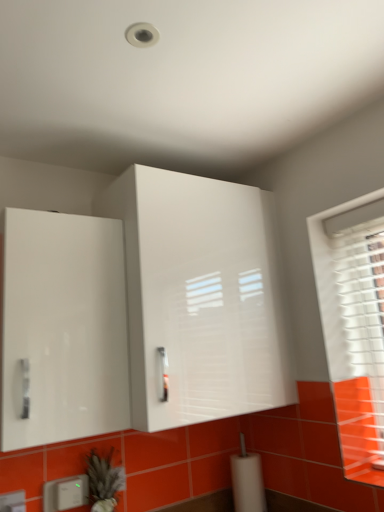
Find the location of a particular element. The image size is (384, 512). white glossy cabinet at left, the first cabinetry in the left-to-right sequence is located at coordinates (63, 328).

In order to click on white glossy cabinet at upper center, the 2th cabinetry in the left-to-right sequence in this screenshot , I will do `click(200, 298)`.

Locate an element on the screen. white glossy cabinet at left, the second cabinetry positioned from the right is located at coordinates (63, 328).

Are green fuzzy plant at lower left and white plastic electric outlet at lower left, acting as the second electric outlet starting from the front, far apart?

No, there isn't a large distance between green fuzzy plant at lower left and white plastic electric outlet at lower left, acting as the second electric outlet starting from the front.

Based on the photo, from a real-world perspective, is green fuzzy plant at lower left physically above white plastic electric outlet at lower left, positioned as the first electric outlet in right-to-left order?

No, from a real-world perspective, green fuzzy plant at lower left is not above white plastic electric outlet at lower left, positioned as the first electric outlet in right-to-left order.

Which is farther from the camera, (95,480) or (67,484)?

The point (95,480) is farther.

The image size is (384, 512). Find the location of `electric outlet lying behind the green fuzzy plant at lower left`. electric outlet lying behind the green fuzzy plant at lower left is located at coordinates (65, 493).

How different are the orientations of white glossy cabinet at upper center, the 2th cabinetry in the left-to-right sequence, and white plastic electric outlet at lower left, which appears as the first electric outlet when viewed from the left, in degrees?

There is a 0.00592-degree angle between the facing directions of white glossy cabinet at upper center, the 2th cabinetry in the left-to-right sequence, and white plastic electric outlet at lower left, which appears as the first electric outlet when viewed from the left.

Is white glossy cabinet at upper center, placed as the first cabinetry when sorted from right to left, spatially inside white plastic electric outlet at lower left, arranged as the 2th electric outlet when viewed from the back, or outside of it?

white glossy cabinet at upper center, placed as the first cabinetry when sorted from right to left, lies outside white plastic electric outlet at lower left, arranged as the 2th electric outlet when viewed from the back.

From a real-world perspective, which is physically below, white glossy cabinet at upper center, the 2th cabinetry in the left-to-right sequence, or white plastic electric outlet at lower left, marked as the 2th electric outlet in a right-to-left arrangement?

white plastic electric outlet at lower left, marked as the 2th electric outlet in a right-to-left arrangement, from a real-world perspective.

Is white glossy cabinet at upper center, placed as the first cabinetry when sorted from right to left, aimed at white plastic electric outlet at lower left, arranged as the 2th electric outlet when viewed from the back?

No, white glossy cabinet at upper center, placed as the first cabinetry when sorted from right to left, is not facing towards white plastic electric outlet at lower left, arranged as the 2th electric outlet when viewed from the back.

Between white plastic electric outlet at lower left, positioned as the first electric outlet in right-to-left order, and white glossy cabinet at left, the first cabinetry in the left-to-right sequence, which one has larger width?

white glossy cabinet at left, the first cabinetry in the left-to-right sequence.

Can we say white plastic electric outlet at lower left, acting as the second electric outlet starting from the front, lies outside white glossy cabinet at left, the first cabinetry in the left-to-right sequence?

white plastic electric outlet at lower left, acting as the second electric outlet starting from the front, lies outside white glossy cabinet at left, the first cabinetry in the left-to-right sequence,'s area.

The width and height of the screenshot is (384, 512). Find the location of `cabinetry that is the 1st object located above the white plastic electric outlet at lower left, acting as the second electric outlet starting from the front (from the image's perspective)`. cabinetry that is the 1st object located above the white plastic electric outlet at lower left, acting as the second electric outlet starting from the front (from the image's perspective) is located at coordinates (63, 328).

How much distance is there between white plastic electric outlet at lower left, acting as the second electric outlet starting from the front, and white glossy cabinet at upper center, the 2th cabinetry in the left-to-right sequence?

The distance of white plastic electric outlet at lower left, acting as the second electric outlet starting from the front, from white glossy cabinet at upper center, the 2th cabinetry in the left-to-right sequence, is 31.27 inches.

Is white plastic electric outlet at lower left, arranged as the second electric outlet when viewed from the left, aimed at white glossy cabinet at upper center, the 2th cabinetry in the left-to-right sequence?

No, white plastic electric outlet at lower left, arranged as the second electric outlet when viewed from the left, does not turn towards white glossy cabinet at upper center, the 2th cabinetry in the left-to-right sequence.

Between point (64, 483) and point (166, 344), which one is positioned behind?

Point (64, 483)

Is white glossy cabinet at upper center, placed as the first cabinetry when sorted from right to left, smaller than white plastic electric outlet at lower left, positioned as the first electric outlet in right-to-left order?

Actually, white glossy cabinet at upper center, placed as the first cabinetry when sorted from right to left, might be larger than white plastic electric outlet at lower left, positioned as the first electric outlet in right-to-left order.

From a real-world perspective, is white glossy cabinet at upper center, the 2th cabinetry in the left-to-right sequence, positioned under white plastic electric outlet at lower left, positioned as the first electric outlet in right-to-left order, based on gravity?

No, from a real-world perspective, white glossy cabinet at upper center, the 2th cabinetry in the left-to-right sequence, is not under white plastic electric outlet at lower left, positioned as the first electric outlet in right-to-left order.

Can you tell me how much white glossy cabinet at upper center, the 2th cabinetry in the left-to-right sequence, and white plastic electric outlet at lower left, which ranks as the 1th electric outlet in back-to-front order, differ in facing direction?

They differ by 0.00221 degrees in their facing directions.

Relative to white plastic electric outlet at lower left, acting as the second electric outlet starting from the front, is white glossy cabinet at upper center, placed as the first cabinetry when sorted from right to left, in front or behind?

white glossy cabinet at upper center, placed as the first cabinetry when sorted from right to left, is positioned closer to the viewer than white plastic electric outlet at lower left, acting as the second electric outlet starting from the front.

In terms of size, does white glossy cabinet at left, the second cabinetry positioned from the right, appear bigger or smaller than green fuzzy plant at lower left?

In the image, white glossy cabinet at left, the second cabinetry positioned from the right, appears to be larger than green fuzzy plant at lower left.

Is white glossy cabinet at left, the first cabinetry in the left-to-right sequence, situated inside green fuzzy plant at lower left or outside?

white glossy cabinet at left, the first cabinetry in the left-to-right sequence, cannot be found inside green fuzzy plant at lower left.

Looking at this image, is white glossy cabinet at left, the first cabinetry in the left-to-right sequence, turned away from green fuzzy plant at lower left?

That's not correct — white glossy cabinet at left, the first cabinetry in the left-to-right sequence, is not looking away from green fuzzy plant at lower left.

Is point (59, 379) more distant than point (157, 409)?

No, it is not.

Considering the relative positions of white glossy cabinet at left, the second cabinetry positioned from the right, and white glossy cabinet at upper center, placed as the first cabinetry when sorted from right to left, in the image provided, is white glossy cabinet at left, the second cabinetry positioned from the right, to the left of white glossy cabinet at upper center, placed as the first cabinetry when sorted from right to left, from the viewer's perspective?

Yes, white glossy cabinet at left, the second cabinetry positioned from the right, is to the left of white glossy cabinet at upper center, placed as the first cabinetry when sorted from right to left.

Would you say white glossy cabinet at left, the second cabinetry positioned from the right, is outside white glossy cabinet at upper center, the 2th cabinetry in the left-to-right sequence?

That's correct, white glossy cabinet at left, the second cabinetry positioned from the right, is outside of white glossy cabinet at upper center, the 2th cabinetry in the left-to-right sequence.

Is white glossy cabinet at left, the first cabinetry in the left-to-right sequence, positioned in front of white glossy cabinet at upper center, placed as the first cabinetry when sorted from right to left?

Yes, white glossy cabinet at left, the first cabinetry in the left-to-right sequence, is closer to the viewer.

You are a GUI agent. You are given a task and a screenshot of the screen. Output one action in this format:
    pyautogui.click(x=<x>, y=<y>)
    Task: Click on the plant that is below the white plastic electric outlet at lower left, acting as the second electric outlet starting from the front (from the image's perspective)
    Image resolution: width=384 pixels, height=512 pixels.
    Given the screenshot: What is the action you would take?
    pyautogui.click(x=104, y=481)

I want to click on the 2nd electric outlet to the left of the white glossy cabinet at upper center, placed as the first cabinetry when sorted from right to left, counting from the anchor's position, so click(x=13, y=502).

From the image, which object appears to be farther from white plastic electric outlet at lower left, which ranks as the 1th electric outlet in back-to-front order, green fuzzy plant at lower left or white glossy cabinet at left, the first cabinetry in the left-to-right sequence?

The object further to white plastic electric outlet at lower left, which ranks as the 1th electric outlet in back-to-front order, is white glossy cabinet at left, the first cabinetry in the left-to-right sequence.

Considering their positions, is white glossy cabinet at upper center, the 2th cabinetry in the left-to-right sequence, positioned further to white plastic electric outlet at lower left, which ranks as the first electric outlet in front-to-back order, than green fuzzy plant at lower left?

Based on the image, white glossy cabinet at upper center, the 2th cabinetry in the left-to-right sequence, appears to be further to white plastic electric outlet at lower left, which ranks as the first electric outlet in front-to-back order.

Estimate the real-world distances between objects in this image. Which object is closer to white glossy cabinet at left, the first cabinetry in the left-to-right sequence, white plastic electric outlet at lower left, marked as the 2th electric outlet in a right-to-left arrangement, or white plastic electric outlet at lower left, arranged as the second electric outlet when viewed from the left?

white plastic electric outlet at lower left, arranged as the second electric outlet when viewed from the left, is positioned closer to the anchor white glossy cabinet at left, the first cabinetry in the left-to-right sequence.

Based on their spatial positions, is white plastic electric outlet at lower left, arranged as the second electric outlet when viewed from the left, or green fuzzy plant at lower left closer to white glossy cabinet at upper center, placed as the first cabinetry when sorted from right to left?

Among the two, green fuzzy plant at lower left is located nearer to white glossy cabinet at upper center, placed as the first cabinetry when sorted from right to left.

Consider the image. Considering their positions, is green fuzzy plant at lower left positioned further to white plastic electric outlet at lower left, which ranks as the first electric outlet in front-to-back order, than white glossy cabinet at left, the second cabinetry positioned from the right?

white glossy cabinet at left, the second cabinetry positioned from the right, is further to white plastic electric outlet at lower left, which ranks as the first electric outlet in front-to-back order.

Which object lies nearer to the anchor point green fuzzy plant at lower left, white plastic electric outlet at lower left, arranged as the second electric outlet when viewed from the left, or white plastic electric outlet at lower left, which ranks as the first electric outlet in front-to-back order?

white plastic electric outlet at lower left, arranged as the second electric outlet when viewed from the left, is positioned closer to the anchor green fuzzy plant at lower left.

Which object lies further to the anchor point white glossy cabinet at left, the first cabinetry in the left-to-right sequence, white plastic electric outlet at lower left, positioned as the first electric outlet in right-to-left order, or white plastic electric outlet at lower left, arranged as the 2th electric outlet when viewed from the back?

Among the two, white plastic electric outlet at lower left, arranged as the 2th electric outlet when viewed from the back, is located further to white glossy cabinet at left, the first cabinetry in the left-to-right sequence.

Based on their spatial positions, is green fuzzy plant at lower left or white glossy cabinet at left, the first cabinetry in the left-to-right sequence, closer to white glossy cabinet at upper center, placed as the first cabinetry when sorted from right to left?

The object closer to white glossy cabinet at upper center, placed as the first cabinetry when sorted from right to left, is white glossy cabinet at left, the first cabinetry in the left-to-right sequence.

At what (x,y) coordinates should I click in order to perform the action: click on cabinetry between white glossy cabinet at upper center, placed as the first cabinetry when sorted from right to left, and white plastic electric outlet at lower left, positioned as the first electric outlet in right-to-left order, from top to bottom. Please return your answer as a coordinate pair (x, y). Looking at the image, I should click on pos(63,328).

The image size is (384, 512). Identify the location of electric outlet between white glossy cabinet at left, the first cabinetry in the left-to-right sequence, and white plastic electric outlet at lower left, acting as the second electric outlet starting from the front, vertically. click(13, 502).

You are a GUI agent. You are given a task and a screenshot of the screen. Output one action in this format:
    pyautogui.click(x=<x>, y=<y>)
    Task: Click on the electric outlet located between white plastic electric outlet at lower left, which appears as the first electric outlet when viewed from the left, and green fuzzy plant at lower left in the left-right direction
    This screenshot has width=384, height=512.
    Given the screenshot: What is the action you would take?
    pyautogui.click(x=65, y=493)

Identify the location of cabinetry between white glossy cabinet at upper center, placed as the first cabinetry when sorted from right to left, and green fuzzy plant at lower left in the up-down direction. The width and height of the screenshot is (384, 512). (63, 328).